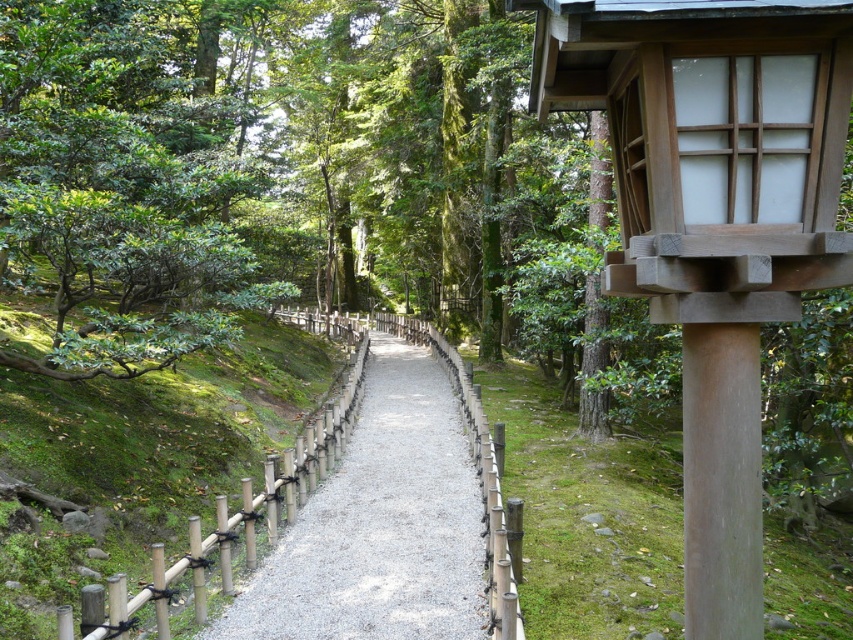
You are a gardener who wants to place a new decorative stone sculpture that is 1 meter wide. You see the gravel at center and the smooth beige pole at right. Which area can accommodate the sculpture without blocking the path?

The gravel at center is wider than the smooth beige pole at right, so the gravel at center can accommodate the sculpture without blocking the path.

From the picture: You are a hiker who wants to place a small backpack on the ground near the smooth beige pole at right. Where should you place it so it doesn not get buried by the gravel at center?

The gravel at center is positioned under the smooth beige pole at right, so placing the backpack directly under the pole would keep it from being buried by the gravel.

You are a gardener planning to plant a new shrub in the forest pathway scene. You have a shrub that requires a space larger than the gravel at center. Can the green leafy bush at left accommodate this shrub?

The green leafy bush at left has a larger size compared to gravel at center, so it can accommodate the shrub that requires a space larger than the gravel at center.